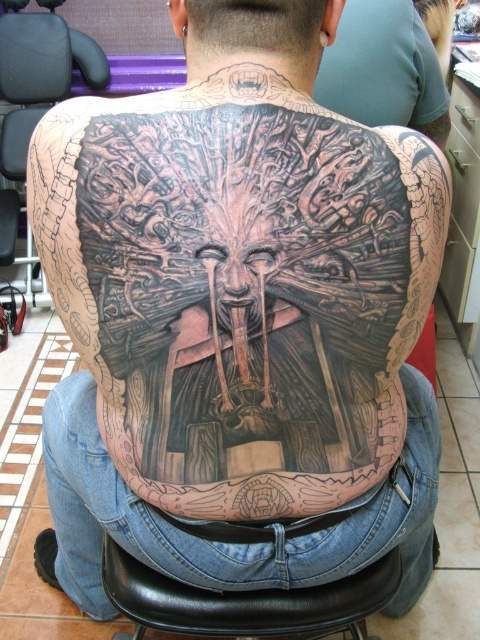
Looking at this image, you are a person who is 1.8 meters tall and want to sit in the black leather chair at lower center. However, there is another black leather chair at upper left in the way. Can you walk to the chair at lower center without bending down?

The two black leather chairs are 2.00 meters apart. Since you are 1.8 meters tall, the distance between the chairs is greater than your height, so you can walk between them without bending down.

You are a photographer setting up a shoot in this scene. You need to decide where to place your camera to ensure both the black tattooed skin at center and the black leather chair at upper left are fully visible in the frame. Considering their sizes, which object should be placed closer to the camera to maintain balance in the composition?

The black tattooed skin at center is not as tall as the black leather chair at upper left, so to maintain balance in the composition, the black tattooed skin at center should be placed closer to the camera.

Consider the image. You are a photographer standing in front of the black tattooed skin at center. You want to take a closeup shot without moving your position. Is the distance sufficient for a clear closeup?

The black tattooed skin at center is 1.37 meters from the viewer, which should be sufficient for a clear closeup shot without needing to move closer.